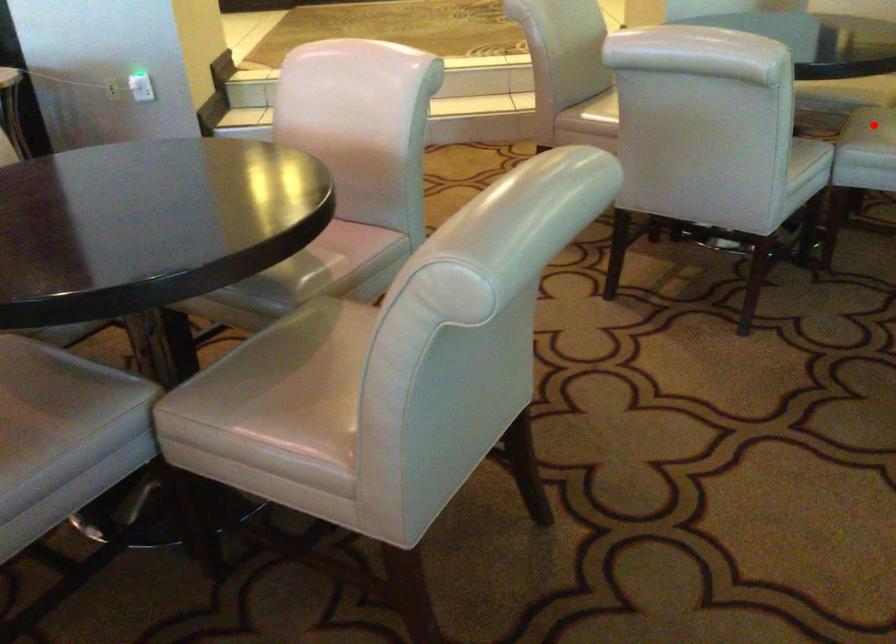
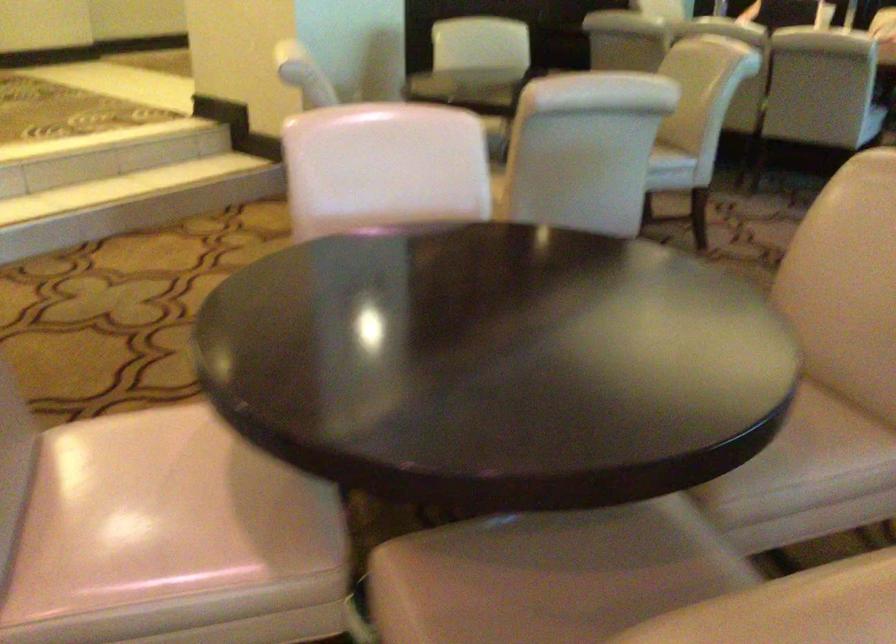
Question: I am providing you with two images of the same scene from different viewpoints. A red point is marked on the first image. At the location where the point appears in image 1, is it still visible in image 2?

Choices:
 (A) Yes
 (B) No

Answer: (B)